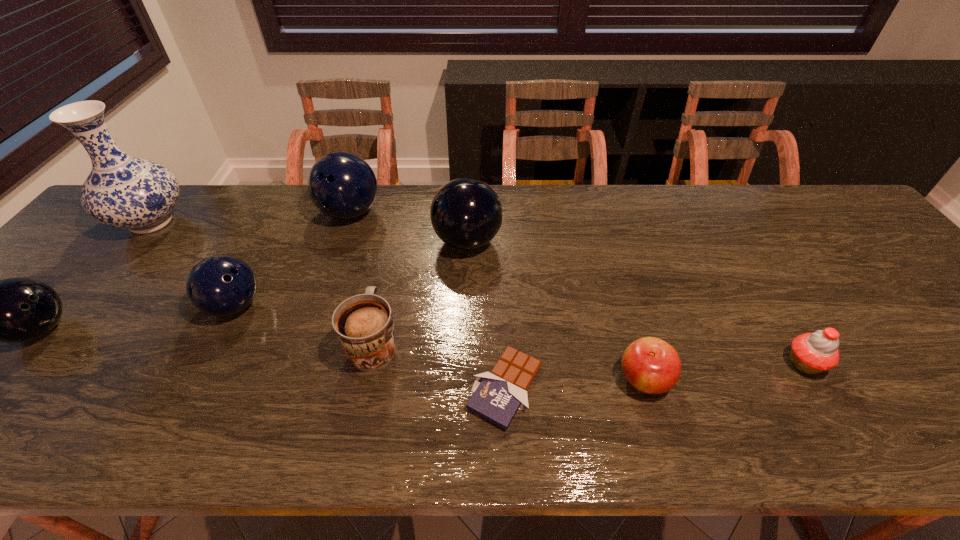
Locate an element on the screen. The width and height of the screenshot is (960, 540). vacant space situated 0.120m on the front of the rightmost object is located at coordinates (848, 436).

Identify the location of vacant space located 0.110m on the right of the second object from right to left. (723, 379).

The height and width of the screenshot is (540, 960). What are the coordinates of `free location located 0.310m on the left of the shortest object` in the screenshot? It's located at (318, 388).

Where is `vase at the far edge`? The height and width of the screenshot is (540, 960). vase at the far edge is located at coordinates (121, 191).

Image resolution: width=960 pixels, height=540 pixels. Identify the location of object located at the near edge. (498, 395).

Image resolution: width=960 pixels, height=540 pixels. I want to click on object that is at the left edge, so click(x=121, y=191).

I want to click on object present at the far left corner, so click(121, 191).

The width and height of the screenshot is (960, 540). Identify the location of free space at the far edge. (722, 188).

Where is `free region at the near edge`? free region at the near edge is located at coordinates (114, 428).

In order to click on vacant space at the left edge of the desktop in this screenshot , I will do `click(117, 256)`.